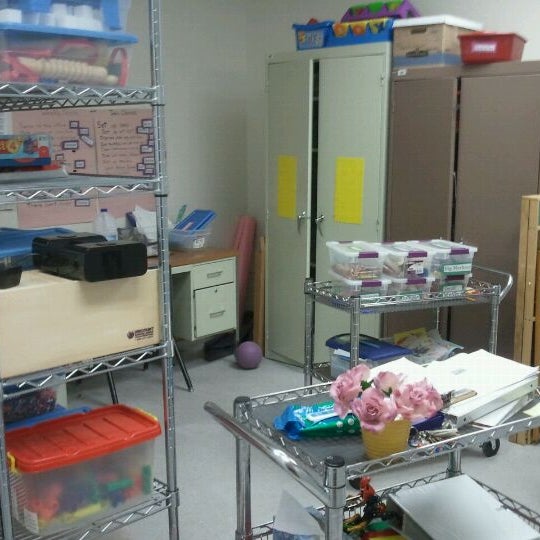
What are the coordinates of `fake flowers` in the screenshot? It's located at (368, 411), (429, 398), (389, 383), (347, 387).